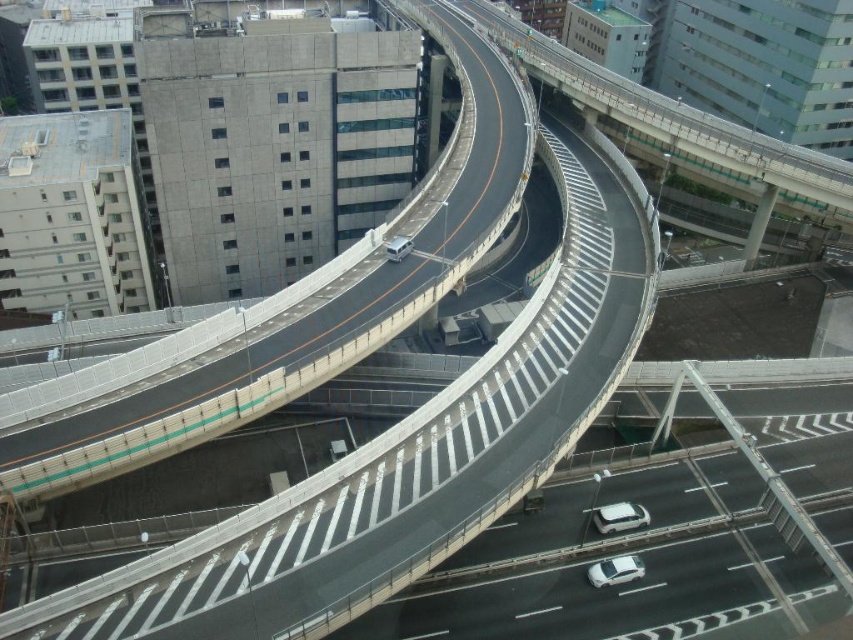
Question: Can you confirm if smooth asphalt highway at center is positioned to the right of concrete bridge at center?

Choices:
 (A) yes
 (B) no

Answer: (A)

Question: Which of the following is the closest to the observer?

Choices:
 (A) coord(85,410)
 (B) coord(398,257)

Answer: (A)

Question: Is white glossy car at center positioned in front of silver metallic van at center?

Choices:
 (A) yes
 (B) no

Answer: (A)

Question: Estimate the real-world distances between objects in this image. Which object is farther from the smooth asphalt highway at center?

Choices:
 (A) silver metallic van at center
 (B) white glossy car at center
 (C) white matte car at center
 (D) concrete bridge at center

Answer: (A)

Question: Can you confirm if white glossy car at center is positioned below silver metallic van at center?

Choices:
 (A) yes
 (B) no

Answer: (A)

Question: Among these objects, which one is farthest from the camera?

Choices:
 (A) white glossy car at center
 (B) silver metallic van at center
 (C) smooth asphalt highway at center

Answer: (B)